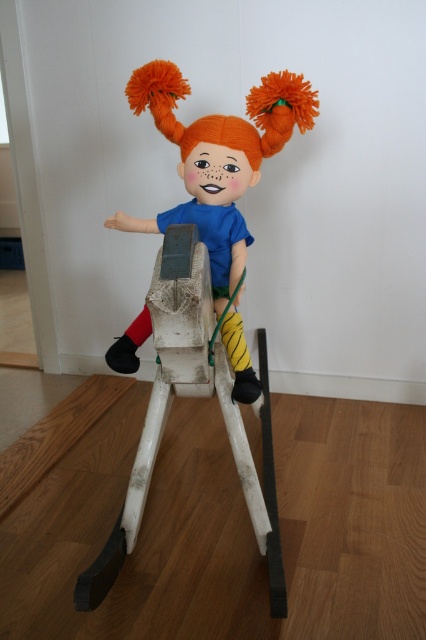
Question: Does knitted orange doll at center appear under white matte wooden rocking horse at center?

Choices:
 (A) no
 (B) yes

Answer: (A)

Question: Can you confirm if knitted orange doll at center is positioned below white matte wooden rocking horse at center?

Choices:
 (A) yes
 (B) no

Answer: (B)

Question: Is knitted orange doll at center below white matte wooden rocking horse at center?

Choices:
 (A) no
 (B) yes

Answer: (A)